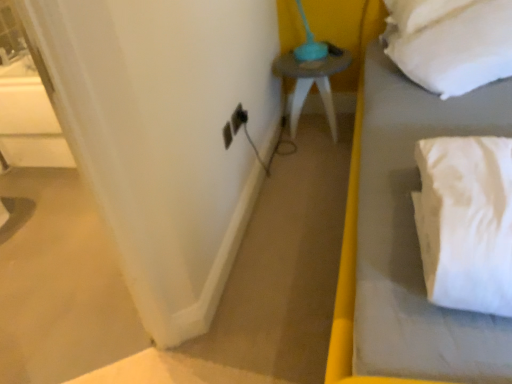
The image size is (512, 384). What are the coordinates of `blank space to the left of white fabric curtain at left` in the screenshot? It's located at (45, 349).